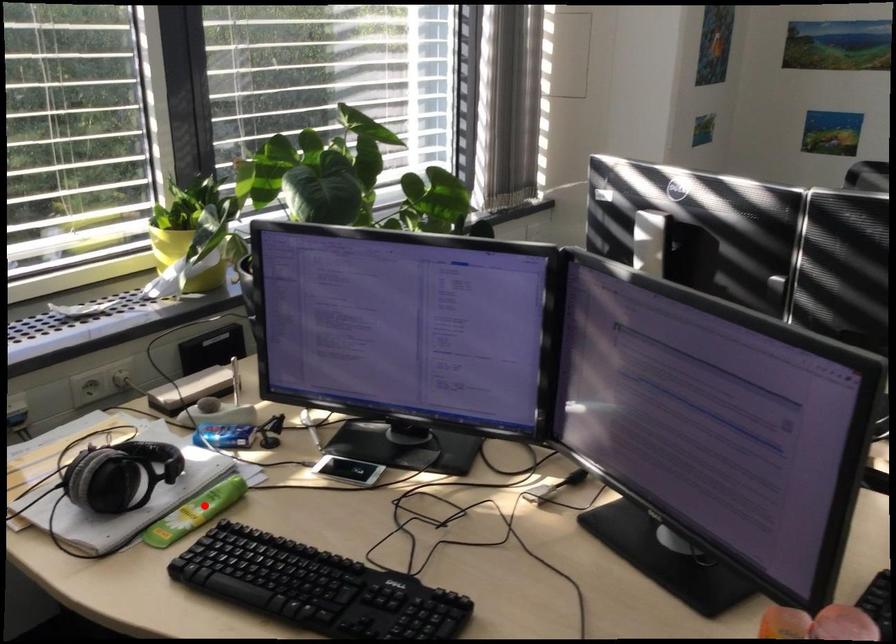
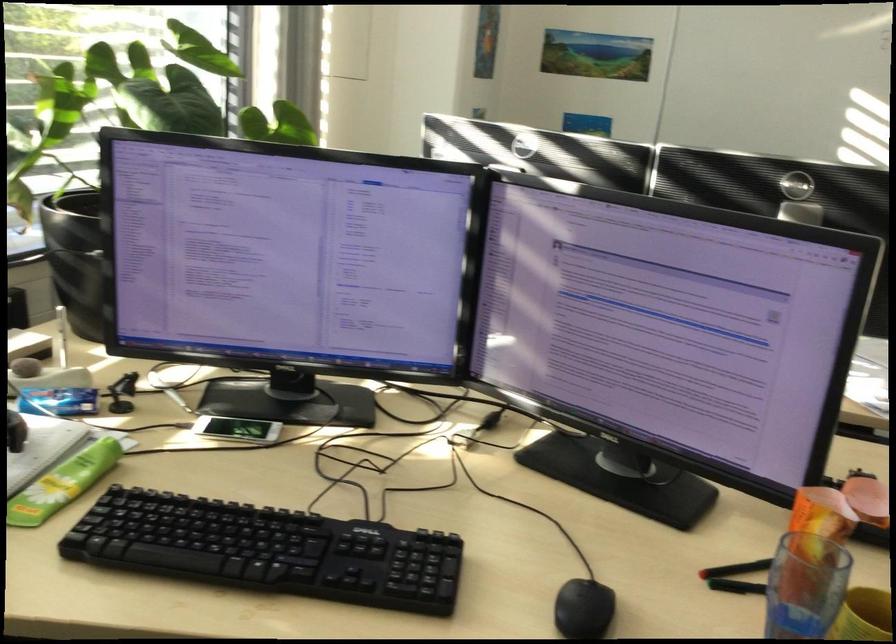
Where in the second image is the point corresponding to the highlighted location from the first image?

(64, 483)